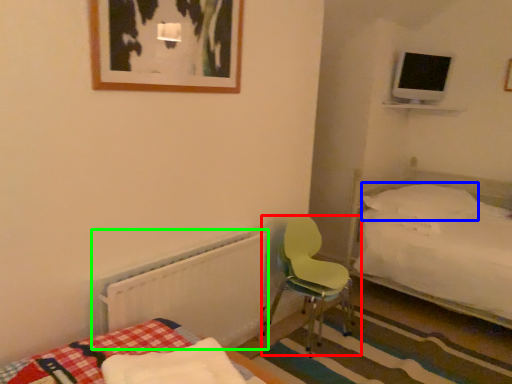
Question: Estimate the real-world distances between objects in this image. Which object is farther from chair (highlighted by a red box), pillow (highlighted by a blue box) or radiator (highlighted by a green box)?

Choices:
 (A) pillow
 (B) radiator

Answer: (A)